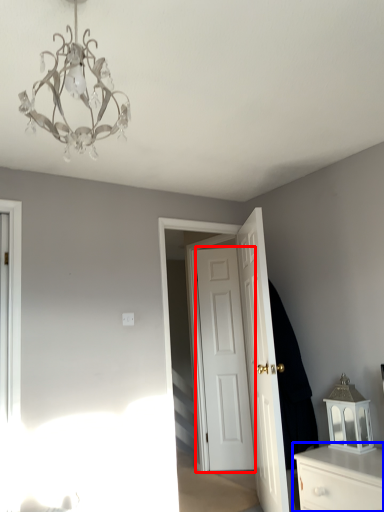
Question: Which of the following is the closest to the observer, door (highlighted by a red box) or chest of drawers (highlighted by a blue box)?

Choices:
 (A) door
 (B) chest of drawers

Answer: (B)